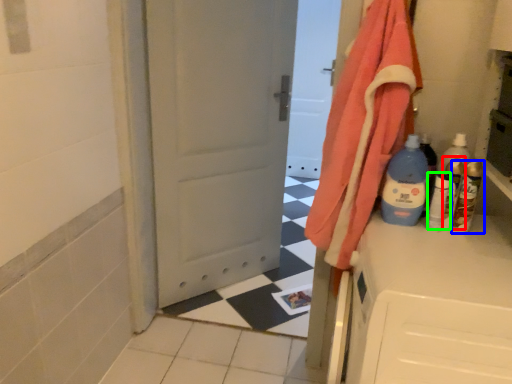
Question: Which object is positioned farthest from bottle (highlighted by a red box)? Select from bottle (highlighted by a blue box) and bottle (highlighted by a green box).

Choices:
 (A) bottle
 (B) bottle

Answer: (A)